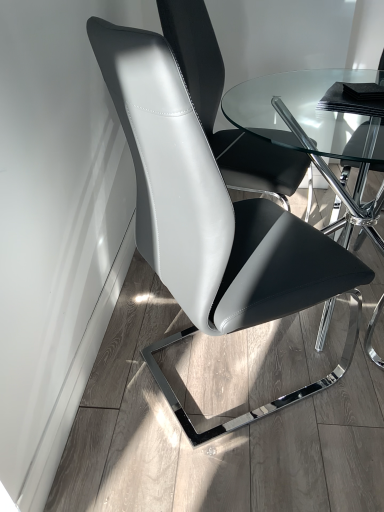
Where is `blank space to the left of matte black chair at center, the 1th chair when ordered from front to back`? This screenshot has height=512, width=384. blank space to the left of matte black chair at center, the 1th chair when ordered from front to back is located at coordinates (120, 379).